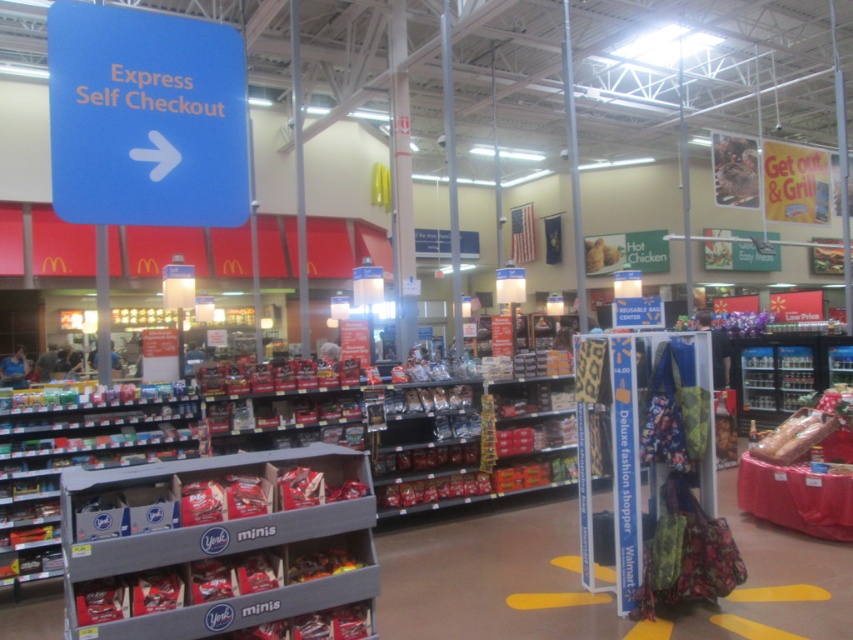
You are a customer in Walmart looking for the self checkout. You see the blue plastic sign at upper left and the shiny metallic candy at center. Which object is located above the other?

The blue plastic sign at upper left is positioned over shiny metallic candy at center, so the blue plastic sign at upper left is above the shiny metallic candy at center.

You are a customer in the Walmart store and want to grab both the gray plastic shelf at lower left and the shiny plastic baguette at right. Since you can only reach one at a time, which one should you reach for first if you want to pick up the one closer to you?

The gray plastic shelf at lower left is positioned on the left side of the shiny plastic baguette at right, so it is closer to you. You should reach for the gray plastic shelf at lower left first.

You are a customer in Walmart looking for the candy section. You see the blue plastic sign at upper left and the shiny metallic candy at center. Which object is closer to you?

The blue plastic sign at upper left is in front of shiny metallic candy at center, so it is closer to you.